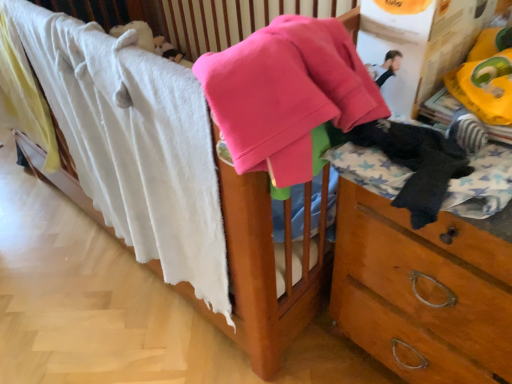
In order to face white soft towel at upper left, should I rotate leftwards or rightwards?

A 17.351 degree turn to the left will do.

What is the approximate width of white soft towel at upper left?

10.41 centimeters.

Find the location of a particular element. This screenshot has height=384, width=512. white soft towel at upper left is located at coordinates (132, 142).

Who is shorter, pink fleece sweater at upper center or white soft towel at upper left?

With less height is pink fleece sweater at upper center.

Does pink fleece sweater at upper center have a lesser width compared to white soft towel at upper left?

In fact, pink fleece sweater at upper center might be wider than white soft towel at upper left.

Identify the location of bath towel below the pink fleece sweater at upper center (from a real-world perspective). (132, 142).

From a real-world perspective, relative to white soft towel at upper left, is pink fleece sweater at upper center vertically above or below?

pink fleece sweater at upper center is situated higher than white soft towel at upper left in the real world.

Which object is more forward, white soft towel at upper left or pink fleece sweater at upper center?

pink fleece sweater at upper center is more forward.

Can you confirm if white soft towel at upper left is bigger than pink fleece sweater at upper center?

Yes.

Is white soft towel at upper left facing away from pink fleece sweater at upper center?

No, white soft towel at upper left is not facing away from pink fleece sweater at upper center.

Considering the positions of objects white soft towel at upper left and pink fleece sweater at upper center in the image provided, who is more to the right, white soft towel at upper left or pink fleece sweater at upper center?

pink fleece sweater at upper center is more to the right.

In the scene shown: Is black fuzzy socks at right oriented towards white soft towel at upper left?

No, black fuzzy socks at right is not aimed at white soft towel at upper left.

From the image's perspective, is black fuzzy socks at right located above or below white soft towel at upper left?

black fuzzy socks at right is situated lower than white soft towel at upper left in the image.

Looking at this image, is black fuzzy socks at right wider or thinner than white soft towel at upper left?

black fuzzy socks at right is wider than white soft towel at upper left.

Between pink fleece sweater at upper center and black fuzzy socks at right, which one has larger size?

pink fleece sweater at upper center is bigger.

How different are the orientations of pink fleece sweater at upper center and black fuzzy socks at right in degrees?

There is a 1.83-degree angle between the facing directions of pink fleece sweater at upper center and black fuzzy socks at right.

From a real-world perspective, is pink fleece sweater at upper center beneath black fuzzy socks at right?

Actually, pink fleece sweater at upper center is physically above black fuzzy socks at right in the real world.

Does pink fleece sweater at upper center come behind black fuzzy socks at right?

No, the depth of pink fleece sweater at upper center is less than that of black fuzzy socks at right.

Find the location of a particular element. The height and width of the screenshot is (384, 512). clothing in front of the white soft towel at upper left is located at coordinates (416, 163).

Consider the image. From a real-world perspective, is white soft towel at upper left on top of black fuzzy socks at right?

No, from a real-world perspective, white soft towel at upper left is not above black fuzzy socks at right.

Does point (96, 96) lie behind point (448, 175)?

Yes.

Looking at this image, can you confirm if white soft towel at upper left is taller than black fuzzy socks at right?

Yes.

Is pink fleece sweater at upper center at the back of black fuzzy socks at right?

No.

From a real-world perspective, is black fuzzy socks at right above or below pink fleece sweater at upper center?

In terms of real-world spatial position, black fuzzy socks at right is below pink fleece sweater at upper center.

In terms of size, does black fuzzy socks at right appear bigger or smaller than pink fleece sweater at upper center?

In the image, black fuzzy socks at right appears to be smaller than pink fleece sweater at upper center.

How far apart are black fuzzy socks at right and pink fleece sweater at upper center?

5.57 inches.

What are the coordinates of `baby clothe above the white soft towel at upper left (from a real-world perspective)` in the screenshot? It's located at (287, 93).

Where is `bath towel behind the pink fleece sweater at upper center`? The height and width of the screenshot is (384, 512). bath towel behind the pink fleece sweater at upper center is located at coordinates click(x=132, y=142).

Based on their spatial positions, is black fuzzy socks at right or pink fleece sweater at upper center closer to white soft towel at upper left?

pink fleece sweater at upper center.

Looking at this image, estimate the real-world distances between objects in this image. Which object is further from black fuzzy socks at right, white soft towel at upper left or pink fleece sweater at upper center?

Based on the image, white soft towel at upper left appears to be further to black fuzzy socks at right.

When comparing their distances from pink fleece sweater at upper center, does white soft towel at upper left or black fuzzy socks at right seem closer?

Among the two, black fuzzy socks at right is located nearer to pink fleece sweater at upper center.

Based on their spatial positions, is pink fleece sweater at upper center or black fuzzy socks at right closer to white soft towel at upper left?

Among the two, pink fleece sweater at upper center is located nearer to white soft towel at upper left.

Based on their spatial positions, is black fuzzy socks at right or white soft towel at upper left closer to pink fleece sweater at upper center?

The object closer to pink fleece sweater at upper center is black fuzzy socks at right.

Estimate the real-world distances between objects in this image. Which object is further from black fuzzy socks at right, pink fleece sweater at upper center or white soft towel at upper left?

white soft towel at upper left.

Locate an element on the screen. This screenshot has height=384, width=512. baby clothe situated between white soft towel at upper left and black fuzzy socks at right from left to right is located at coordinates (287, 93).